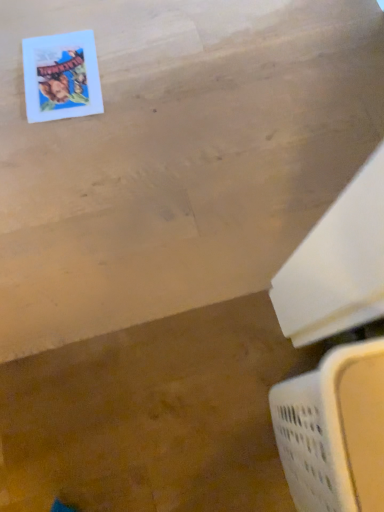
Question: Is matte paper comic book at upper left not inside white plastic laundry basket at lower right?

Choices:
 (A) no
 (B) yes

Answer: (B)

Question: Can you confirm if matte paper comic book at upper left is positioned to the left of white plastic laundry basket at lower right?

Choices:
 (A) yes
 (B) no

Answer: (A)

Question: Does matte paper comic book at upper left turn towards white plastic laundry basket at lower right?

Choices:
 (A) yes
 (B) no

Answer: (B)

Question: From a real-world perspective, is matte paper comic book at upper left positioned under white plastic laundry basket at lower right based on gravity?

Choices:
 (A) no
 (B) yes

Answer: (B)

Question: Is matte paper comic book at upper left at the right side of white plastic laundry basket at lower right?

Choices:
 (A) no
 (B) yes

Answer: (A)

Question: Does matte paper comic book at upper left lie behind white plastic laundry basket at lower right?

Choices:
 (A) no
 (B) yes

Answer: (B)

Question: Could you tell me if white plastic laundry basket at lower right is turned towards matte paper comic book at upper left?

Choices:
 (A) no
 (B) yes

Answer: (A)

Question: Considering the relative sizes of white plastic laundry basket at lower right and matte paper comic book at upper left in the image provided, is white plastic laundry basket at lower right bigger than matte paper comic book at upper left?

Choices:
 (A) no
 (B) yes

Answer: (B)

Question: Is matte paper comic book at upper left surrounded by white plastic laundry basket at lower right?

Choices:
 (A) no
 (B) yes

Answer: (A)

Question: Is white plastic laundry basket at lower right at the right side of matte paper comic book at upper left?

Choices:
 (A) no
 (B) yes

Answer: (B)

Question: From the image's perspective, would you say white plastic laundry basket at lower right is shown under matte paper comic book at upper left?

Choices:
 (A) yes
 (B) no

Answer: (A)

Question: Considering the relative positions of white plastic laundry basket at lower right and matte paper comic book at upper left in the image provided, is white plastic laundry basket at lower right in front of matte paper comic book at upper left?

Choices:
 (A) yes
 (B) no

Answer: (A)

Question: In terms of width, does matte paper comic book at upper left look wider or thinner when compared to white plastic laundry basket at lower right?

Choices:
 (A) thin
 (B) wide

Answer: (A)